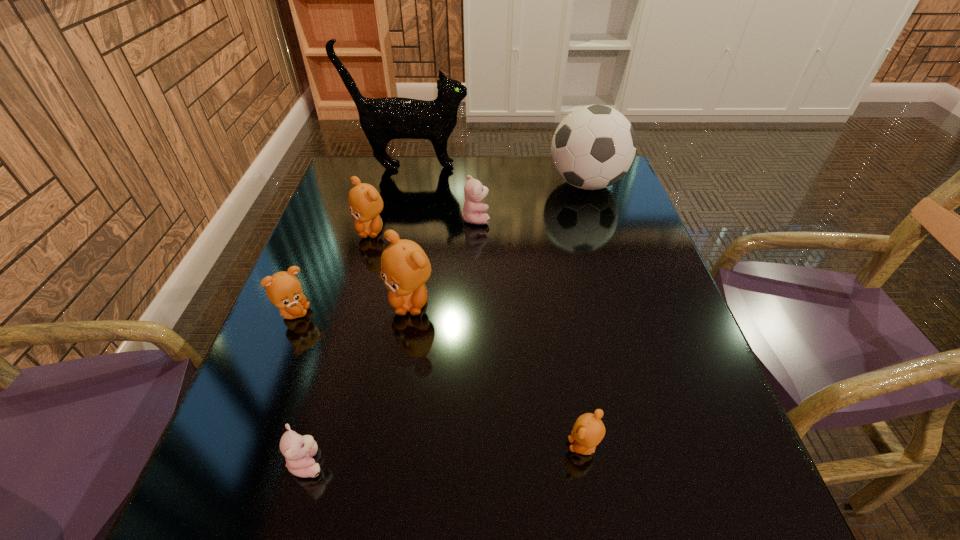
Identify the location of free spot located 0.230m on the face of the leftmost brown teddy bear. The width and height of the screenshot is (960, 540). (418, 313).

The image size is (960, 540). I want to click on blank space located at the face of the bigger pink teddy bear, so click(x=601, y=218).

The width and height of the screenshot is (960, 540). What are the coordinates of `vacant space situated 0.390m on the face of the rightmost teddy bear` in the screenshot? It's located at (333, 446).

The width and height of the screenshot is (960, 540). What are the coordinates of `free space located 0.340m on the face of the rightmost teddy bear` in the screenshot? It's located at (363, 446).

Locate an element on the screen. This screenshot has width=960, height=540. free location located on the face of the rightmost teddy bear is located at coordinates (490, 446).

Image resolution: width=960 pixels, height=540 pixels. Identify the location of vacant space located 0.360m at the face of the nearer pink teddy bear. (547, 462).

The width and height of the screenshot is (960, 540). I want to click on cat situated at the far edge, so click(x=382, y=119).

Identify the location of soccer ball that is positioned at the far edge. Image resolution: width=960 pixels, height=540 pixels. (593, 147).

This screenshot has height=540, width=960. Identify the location of cat positioned at the left edge. (382, 119).

Locate an element on the screen. The width and height of the screenshot is (960, 540). object situated at the right edge is located at coordinates (593, 147).